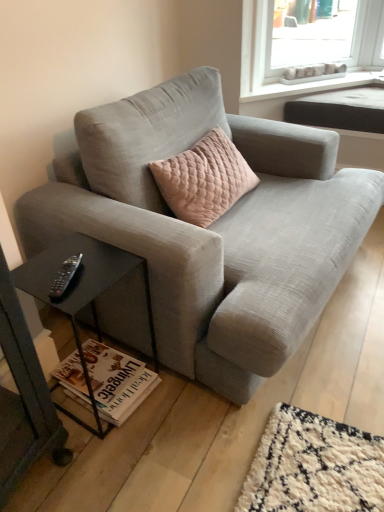
Where is `unoccupied area behind black plastic remote at lower left`? unoccupied area behind black plastic remote at lower left is located at coordinates (77, 250).